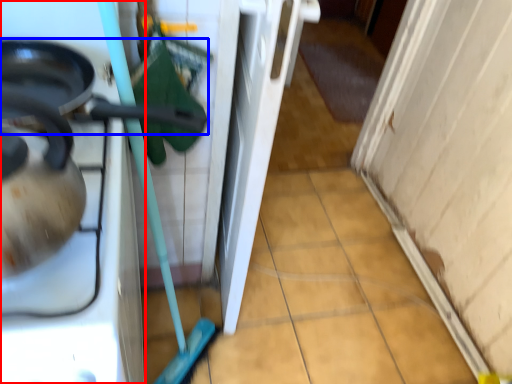
Question: Which object is closer to the camera taking this photo, home appliance (highlighted by a red box) or frying pan (highlighted by a blue box)?

Choices:
 (A) home appliance
 (B) frying pan

Answer: (A)